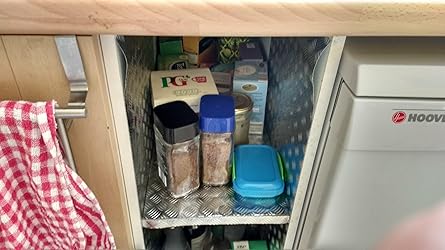
What are the coordinates of `cubbies` in the screenshot? It's located at (270, 91), (266, 234).